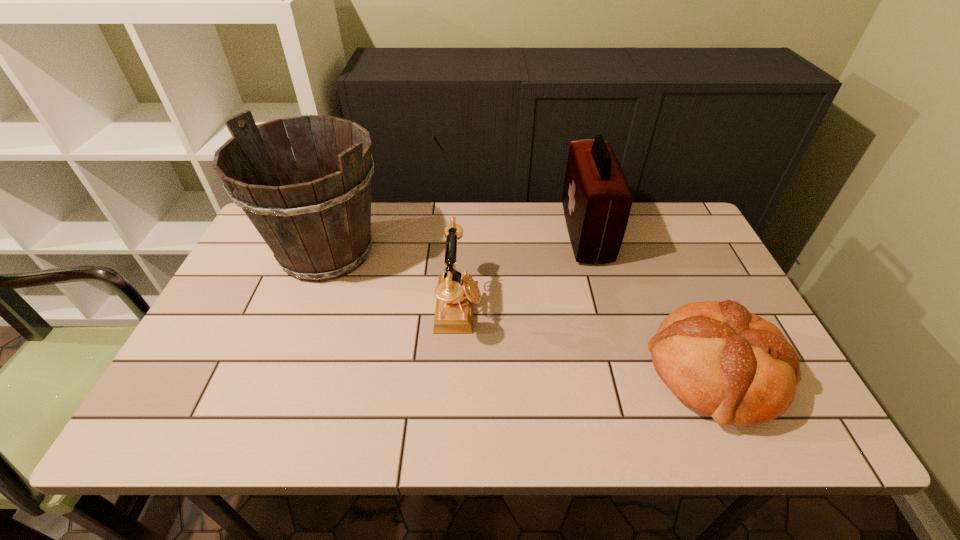
At what (x,y) coordinates should I click in order to perform the action: click on free space between the second shortest object and the tallest object. Please return your answer as a coordinate pair (x, y). The height and width of the screenshot is (540, 960). Looking at the image, I should click on (393, 280).

Choose which object is the second nearest neighbor to the bread. Please provide its 2D coordinates. Your answer should be formatted as a tuple, i.e. [(x, y)], where the tuple contains the x and y coordinates of a point satisfying the conditions above.

[(455, 293)]

Image resolution: width=960 pixels, height=540 pixels. What are the coordinates of `object that stands as the closest to the third tallest object` in the screenshot? It's located at (316, 220).

Image resolution: width=960 pixels, height=540 pixels. What are the coordinates of `vacant region that satisfies the following two spatial constraints: 1. on the dial of the bread; 2. on the right side of the third object from right to left` in the screenshot? It's located at (455, 373).

Where is `vacant space that satisfies the following two spatial constraints: 1. on the side of the third shortest object with the cross symbol; 2. on the back side of the bread`? vacant space that satisfies the following two spatial constraints: 1. on the side of the third shortest object with the cross symbol; 2. on the back side of the bread is located at coordinates pos(625,373).

Where is `free space that satisfies the following two spatial constraints: 1. on the side of the first aid kit with the cross symbol; 2. on the right side of the bread`? free space that satisfies the following two spatial constraints: 1. on the side of the first aid kit with the cross symbol; 2. on the right side of the bread is located at coordinates (625, 373).

Find the location of a particular element. The width and height of the screenshot is (960, 540). free point that satisfies the following two spatial constraints: 1. on the back side of the bread; 2. on the dial of the second object from left to right is located at coordinates (684, 308).

Identify the location of vacant space that satisfies the following two spatial constraints: 1. on the back side of the shortest object; 2. on the side of the first aid kit with the cross symbol. The image size is (960, 540). (652, 233).

I want to click on vacant position in the image that satisfies the following two spatial constraints: 1. on the front side of the bread; 2. on the right side of the tallest object, so click(281, 373).

Locate an element on the screen. This screenshot has height=540, width=960. vacant space that satisfies the following two spatial constraints: 1. on the side of the bread with the cross symbol; 2. on the right side of the first aid kit is located at coordinates (625, 373).